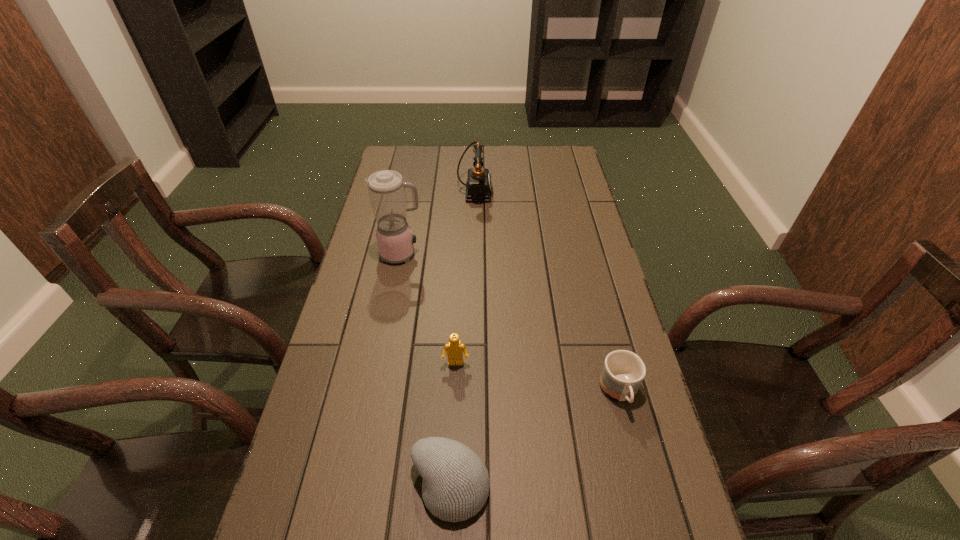
Identify the location of vacant space located on the face of the third nearest object. (447, 531).

You are a GUI agent. You are given a task and a screenshot of the screen. Output one action in this format:
    pyautogui.click(x=<x>, y=<y>)
    Task: Click on the vacant space located 0.050m on the back of the beanie
    This screenshot has height=540, width=960.
    Given the screenshot: What is the action you would take?
    pyautogui.click(x=453, y=430)

The height and width of the screenshot is (540, 960). In order to click on vacant region located on the side with the handle of the mug in this screenshot , I will do `click(634, 449)`.

This screenshot has width=960, height=540. I want to click on object that is at the left edge, so click(386, 188).

This screenshot has height=540, width=960. I want to click on object present at the right edge, so click(x=623, y=371).

Where is `free space at the far edge of the desktop`? free space at the far edge of the desktop is located at coordinates [x=499, y=173].

The height and width of the screenshot is (540, 960). In the image, there is a desktop. Identify the location of vacant space at the left edge. tap(370, 249).

You are a GUI agent. You are given a task and a screenshot of the screen. Output one action in this format:
    pyautogui.click(x=<x>, y=<y>)
    Task: Click on the free space at the right edge of the desktop
    The width and height of the screenshot is (960, 540).
    Given the screenshot: What is the action you would take?
    pyautogui.click(x=583, y=384)

The width and height of the screenshot is (960, 540). Find the location of `free space at the far left corner of the desktop`. free space at the far left corner of the desktop is located at coordinates (389, 154).

In the image, there is a desktop. Identify the location of vacant space at the far right corner. This screenshot has width=960, height=540. (538, 158).